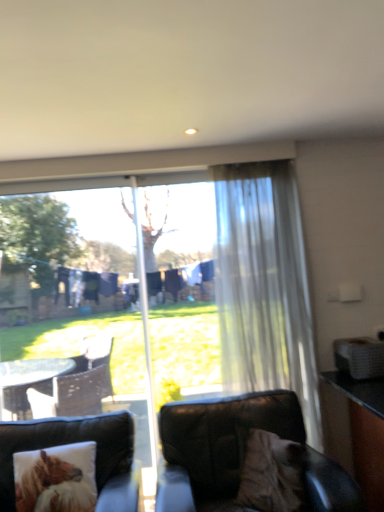
Question: Considering the relative positions of translucent white curtain at right and fluffy brown pillow at lower left in the image provided, is translucent white curtain at right to the right of fluffy brown pillow at lower left from the viewer's perspective?

Choices:
 (A) no
 (B) yes

Answer: (B)

Question: From the image's perspective, is translucent white curtain at right on fluffy brown pillow at lower left?

Choices:
 (A) no
 (B) yes

Answer: (B)

Question: From a real-world perspective, is translucent white curtain at right physically below fluffy brown pillow at lower left?

Choices:
 (A) yes
 (B) no

Answer: (B)

Question: Is translucent white curtain at right surrounding fluffy brown pillow at lower left?

Choices:
 (A) yes
 (B) no

Answer: (B)

Question: Considering the relative sizes of translucent white curtain at right and fluffy brown pillow at lower left in the image provided, is translucent white curtain at right thinner than fluffy brown pillow at lower left?

Choices:
 (A) yes
 (B) no

Answer: (A)

Question: In terms of height, does translucent white curtain at right look taller or shorter compared to leather couch at lower left?

Choices:
 (A) tall
 (B) short

Answer: (A)

Question: Is translucent white curtain at right situated inside leather couch at lower left or outside?

Choices:
 (A) outside
 (B) inside

Answer: (A)

Question: From a real-world perspective, relative to leather couch at lower left, is translucent white curtain at right vertically above or below?

Choices:
 (A) below
 (B) above

Answer: (B)

Question: From the image's perspective, is translucent white curtain at right above or below leather couch at lower left?

Choices:
 (A) below
 (B) above

Answer: (B)

Question: Is black leather chair at lower right in front of or behind translucent white curtain at right in the image?

Choices:
 (A) behind
 (B) front

Answer: (B)

Question: Looking at their shapes, would you say black leather chair at lower right is wider or thinner than translucent white curtain at right?

Choices:
 (A) thin
 (B) wide

Answer: (B)

Question: Is point (291, 408) closer or farther from the camera than point (253, 169)?

Choices:
 (A) closer
 (B) farther

Answer: (A)

Question: Is black leather chair at lower right inside or outside of translucent white curtain at right?

Choices:
 (A) inside
 (B) outside

Answer: (B)

Question: In terms of size, does fluffy brown pillow at lower left appear bigger or smaller than leather couch at lower left?

Choices:
 (A) small
 (B) big

Answer: (A)

Question: From a real-world perspective, is fluffy brown pillow at lower left physically located above or below leather couch at lower left?

Choices:
 (A) above
 (B) below

Answer: (A)